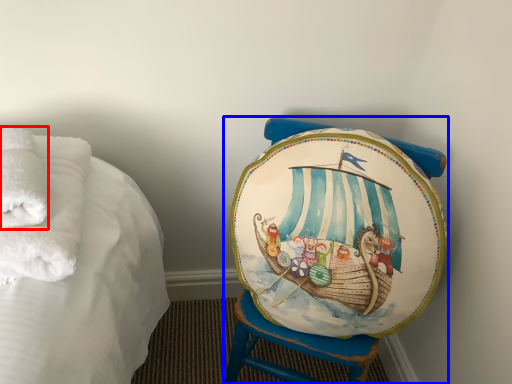
Question: Among these objects, which one is nearest to the camera, bath towel (highlighted by a red box) or furniture (highlighted by a blue box)?

Choices:
 (A) bath towel
 (B) furniture

Answer: (A)